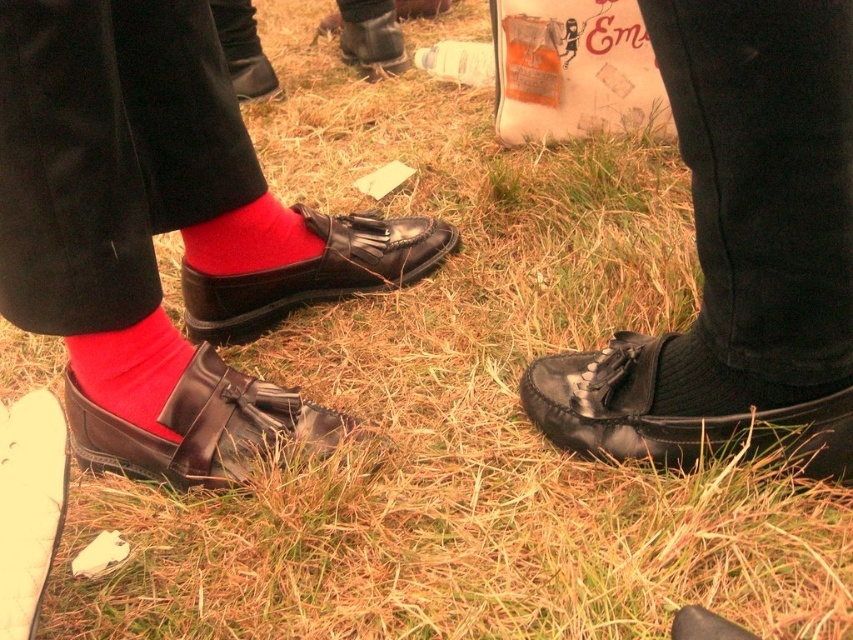
Can you confirm if shiny black loafer at lower center is shorter than matte leather shoe at left?

Incorrect, shiny black loafer at lower center's height does not fall short of matte leather shoe at left's.

Which of these two, shiny black loafer at lower center or matte leather shoe at left, stands shorter?

matte leather shoe at left

Where is `shiny black loafer at lower center`? The height and width of the screenshot is (640, 853). shiny black loafer at lower center is located at coordinates (738, 252).

Which is above, black leather shoe at lower right or matte red sock at left?

matte red sock at left

Is black leather shoe at lower right in front of matte red sock at left?

Yes, it is.

Is point (622, 332) in front of point (160, 358)?

No.

The image size is (853, 640). Find the location of `black leather shoe at lower right`. black leather shoe at lower right is located at coordinates (683, 410).

Does point (309, 428) come behind point (315, 259)?

No.

Consider the image. Is matte leather shoes at left below matte black loafer at left?

Yes, matte leather shoes at left is below matte black loafer at left.

Looking at this image, who is more distant from viewer, (54, 16) or (378, 275)?

The point (378, 275) is more distant.

Where is `matte leather shoes at left`? matte leather shoes at left is located at coordinates [163, 230].